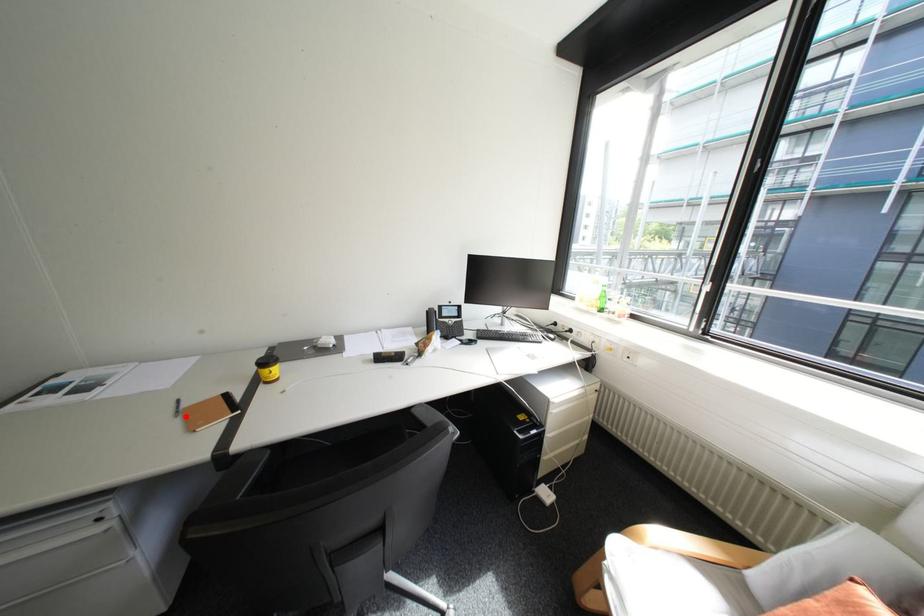
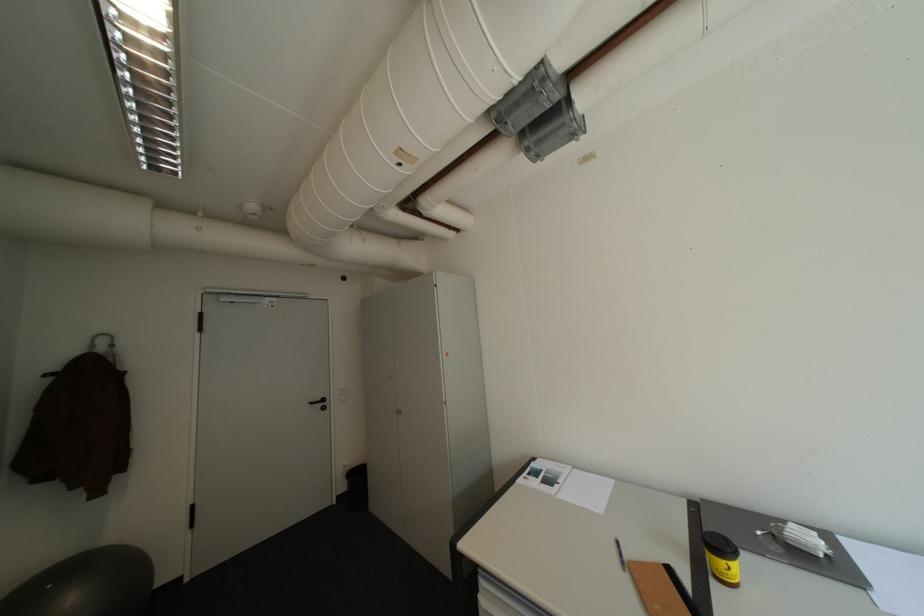
Question: I am providing you with two images of the same scene from different viewpoints. A red point is marked on the first image. Is the red point's position out of view in image 2?

Choices:
 (A) Yes
 (B) No

Answer: (B)